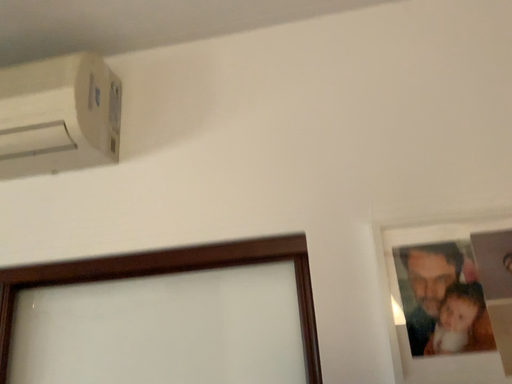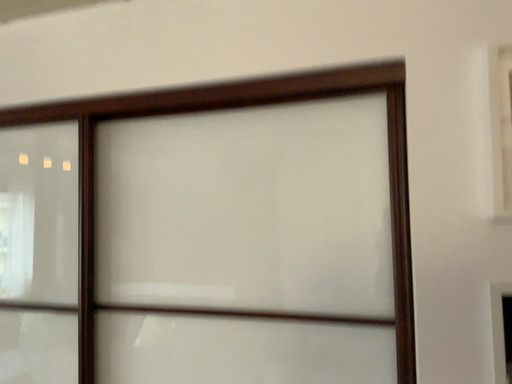
Question: Which way did the camera rotate in the video?

Choices:
 (A) rotated downward
 (B) rotated upward

Answer: (A)